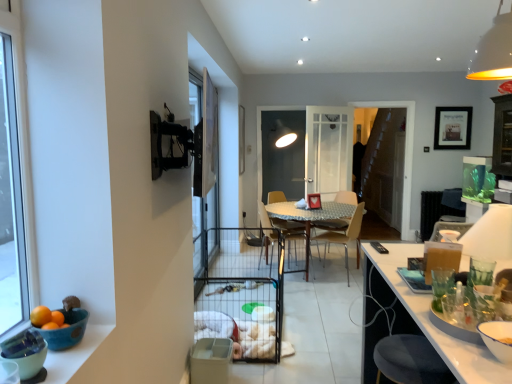
Question: From the image's perspective, does blue ceramic bowl at lower left, the first bowl positioned from the back, appear higher than transparent glass screen door at center, marked as the second screen door in a left-to-right arrangement?

Choices:
 (A) yes
 (B) no

Answer: (B)

Question: Is transparent glass screen door at center, marked as the second screen door in a left-to-right arrangement, completely or partially inside blue ceramic bowl at lower left, which is the second bowl in front-to-back order?

Choices:
 (A) yes
 (B) no

Answer: (B)

Question: Is blue ceramic bowl at lower left, which is the second bowl in front-to-back order, oriented away from transparent glass screen door at center, marked as the second screen door in a left-to-right arrangement?

Choices:
 (A) no
 (B) yes

Answer: (A)

Question: Can you confirm if blue ceramic bowl at lower left, the first bowl positioned from the back, is positioned to the right of transparent glass screen door at center, the second screen door when ordered from front to back?

Choices:
 (A) yes
 (B) no

Answer: (B)

Question: Considering the relative sizes of blue ceramic bowl at lower left, the first bowl positioned from the back, and transparent glass screen door at center, the first screen door when ordered from right to left, in the image provided, is blue ceramic bowl at lower left, the first bowl positioned from the back, bigger than transparent glass screen door at center, the first screen door when ordered from right to left,?

Choices:
 (A) no
 (B) yes

Answer: (A)

Question: From the image's perspective, is green matte bowl at lower left, which is the 2th bowl from back to front, above or below orange matte at left?

Choices:
 (A) above
 (B) below

Answer: (B)

Question: Is green matte bowl at lower left, which is the 2th bowl from back to front, situated inside orange matte at left or outside?

Choices:
 (A) inside
 (B) outside

Answer: (B)

Question: Considering the positions of green matte bowl at lower left, which is the 2th bowl from back to front, and orange matte at left in the image, is green matte bowl at lower left, which is the 2th bowl from back to front, bigger or smaller than orange matte at left?

Choices:
 (A) big
 (B) small

Answer: (A)

Question: Is green matte bowl at lower left, which is the 2th bowl from back to front, wider or thinner than orange matte at left?

Choices:
 (A) wide
 (B) thin

Answer: (A)

Question: From the image's perspective, is wooden chair at center positioned above or below metallic silver table at center?

Choices:
 (A) below
 (B) above

Answer: (B)

Question: In terms of size, does wooden chair at center appear bigger or smaller than metallic silver table at center?

Choices:
 (A) big
 (B) small

Answer: (B)

Question: From a real-world perspective, is wooden chair at center physically located above or below metallic silver table at center?

Choices:
 (A) above
 (B) below

Answer: (A)

Question: Does point (346, 196) appear closer or farther from the camera than point (314, 218)?

Choices:
 (A) farther
 (B) closer

Answer: (A)

Question: From a real-world perspective, is light brown wood chair at center, acting as the first chair starting from the right, above or below blue ceramic bowl at lower left, the first bowl positioned from the back?

Choices:
 (A) below
 (B) above

Answer: (A)

Question: Is light brown wood chair at center, acting as the first chair starting from the right, wider or thinner than blue ceramic bowl at lower left, which is the second bowl in front-to-back order?

Choices:
 (A) wide
 (B) thin

Answer: (A)